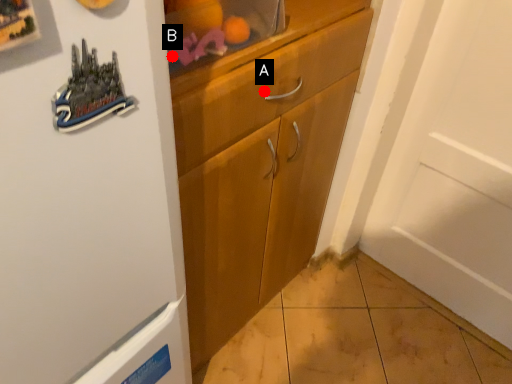
Question: Two points are circled on the image, labeled by A and B beside each circle. Which point is further to the camera?

Choices:
 (A) A is further
 (B) B is further

Answer: (A)